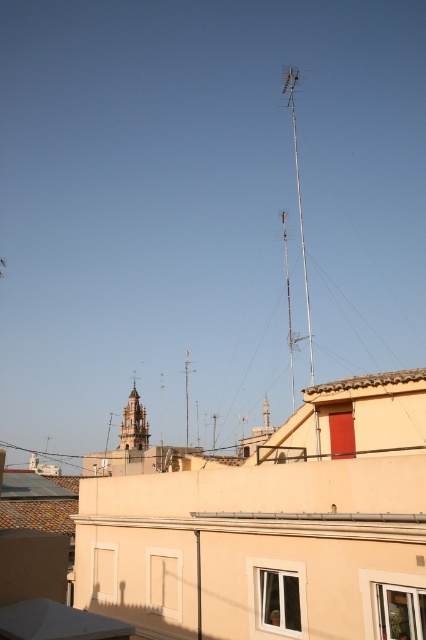
Which is in front, point (287, 77) or point (146, 424)?

Point (146, 424) is more forward.

Who is taller, metallic antenna at upper center or golden stone tower at center?

Standing taller between the two is metallic antenna at upper center.

The image size is (426, 640). What do you see at coordinates (299, 196) in the screenshot?
I see `metallic antenna at upper center` at bounding box center [299, 196].

Where is `metallic antenna at upper center`? metallic antenna at upper center is located at coordinates (299, 196).